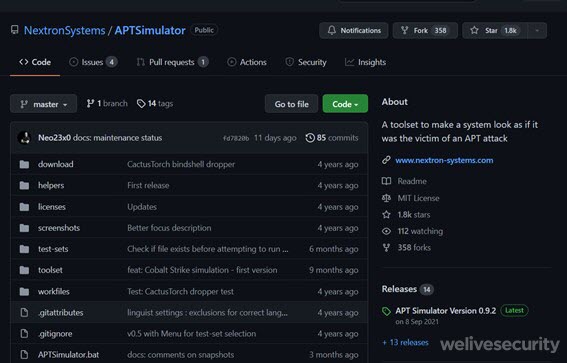
This screenshot has height=363, width=567. Identify the location of folders. (22, 166), (24, 187), (23, 208), (23, 228), (24, 247), (27, 268), (24, 289).